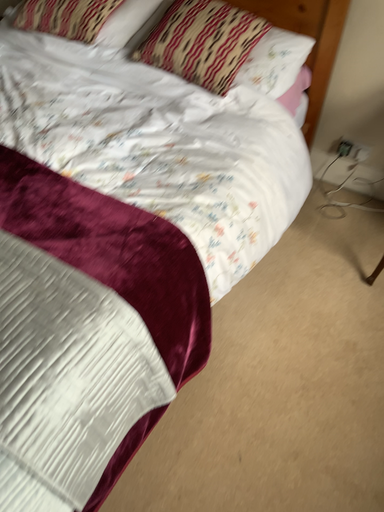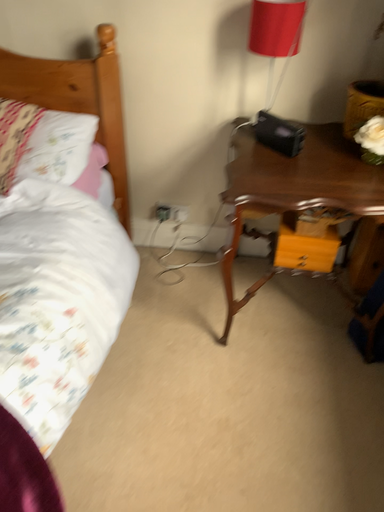
Question: How did the camera likely rotate when shooting the video?

Choices:
 (A) rotated upward
 (B) rotated downward

Answer: (A)